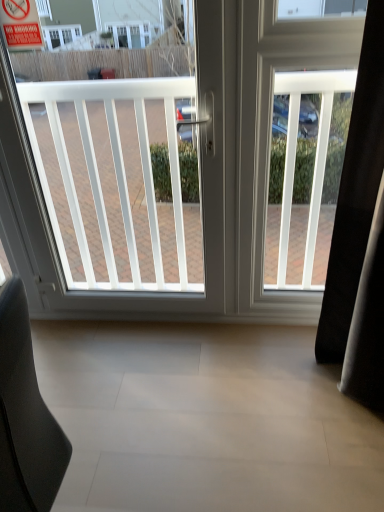
Question: From the image's perspective, is white plastic window at center located above red plastic sign at upper left?

Choices:
 (A) yes
 (B) no

Answer: (B)

Question: Is white plastic window at center not near red plastic sign at upper left?

Choices:
 (A) no
 (B) yes

Answer: (A)

Question: Does white plastic window at center turn towards red plastic sign at upper left?

Choices:
 (A) no
 (B) yes

Answer: (B)

Question: From the image's perspective, is white plastic window at center below red plastic sign at upper left?

Choices:
 (A) yes
 (B) no

Answer: (A)

Question: Can you confirm if white plastic window at center is positioned to the left of red plastic sign at upper left?

Choices:
 (A) no
 (B) yes

Answer: (A)

Question: In the image, is white plastic screen door at right on the left side or the right side of red plastic sign at upper left?

Choices:
 (A) right
 (B) left

Answer: (A)

Question: Is white plastic screen door at right inside the boundaries of red plastic sign at upper left, or outside?

Choices:
 (A) outside
 (B) inside

Answer: (A)

Question: From the image's perspective, relative to red plastic sign at upper left, is white plastic screen door at right above or below?

Choices:
 (A) above
 (B) below

Answer: (B)

Question: Is white plastic screen door at right in front of or behind red plastic sign at upper left in the image?

Choices:
 (A) front
 (B) behind

Answer: (B)

Question: Considering the positions of red plastic sign at upper left and black leather chair at lower left in the image, is red plastic sign at upper left wider or thinner than black leather chair at lower left?

Choices:
 (A) thin
 (B) wide

Answer: (A)

Question: Is red plastic sign at upper left taller or shorter than black leather chair at lower left?

Choices:
 (A) tall
 (B) short

Answer: (B)

Question: In the image, is red plastic sign at upper left positioned in front of or behind black leather chair at lower left?

Choices:
 (A) front
 (B) behind

Answer: (B)

Question: Is point (23, 27) positioned closer to the camera than point (23, 328)?

Choices:
 (A) farther
 (B) closer

Answer: (A)

Question: Based on their sizes in the image, would you say black leather chair at lower left is bigger or smaller than white plastic screen door at right?

Choices:
 (A) big
 (B) small

Answer: (A)

Question: Relative to white plastic screen door at right, is black leather chair at lower left in front or behind?

Choices:
 (A) behind
 (B) front

Answer: (B)